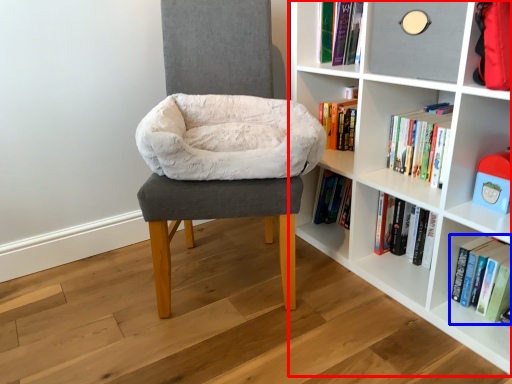
Question: Which object is closer to the camera taking this photo, shelf (highlighted by a red box) or book (highlighted by a blue box)?

Choices:
 (A) shelf
 (B) book

Answer: (A)